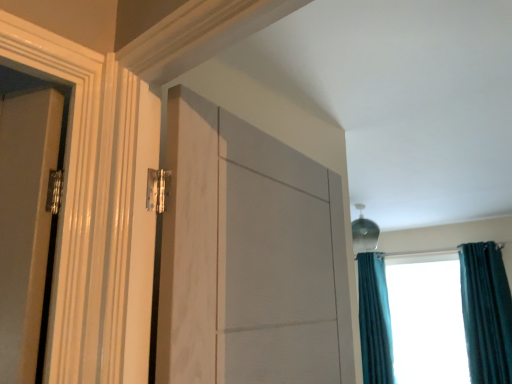
Question: Considering their positions, is white marble door at center located in front of or behind teal velvet curtain at right, which is the first curtain in back-to-front order?

Choices:
 (A) behind
 (B) front

Answer: (B)

Question: From the image's perspective, is white marble door at center located above or below teal velvet curtain at right, marked as the second curtain in a right-to-left arrangement?

Choices:
 (A) below
 (B) above

Answer: (B)

Question: Based on their relative distances, which object is farther from the teal velvet curtain at right, marked as the second curtain in a left-to-right arrangement?

Choices:
 (A) teal curtain at right
 (B) teal velvet curtain at right, the 1th curtain when ordered from left to right
 (C) white marble door at center

Answer: (C)

Question: Which is nearer to the teal curtain at right?

Choices:
 (A) white marble door at center
 (B) teal velvet curtain at right, which is the first curtain in front-to-back order
 (C) teal velvet curtain at right, marked as the second curtain in a right-to-left arrangement

Answer: (B)